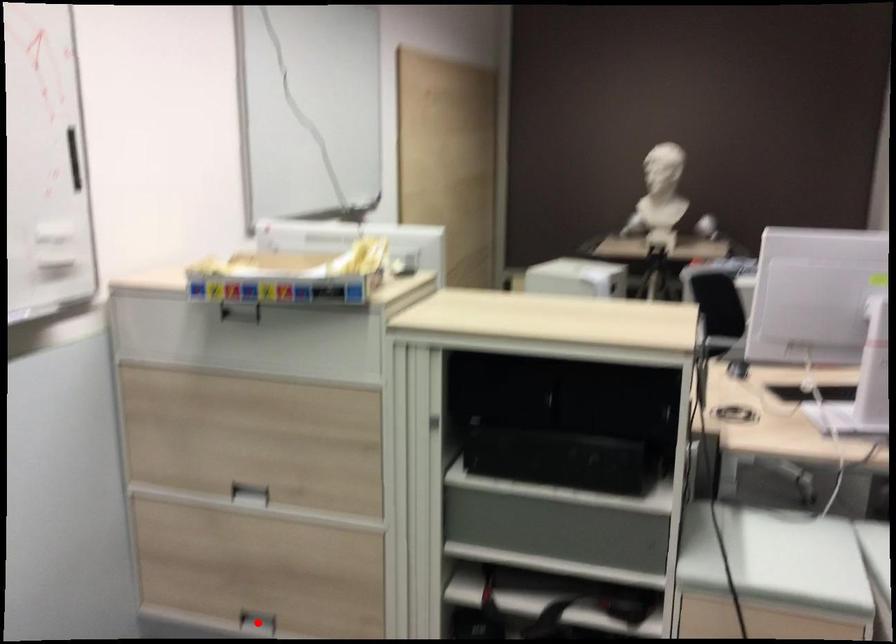
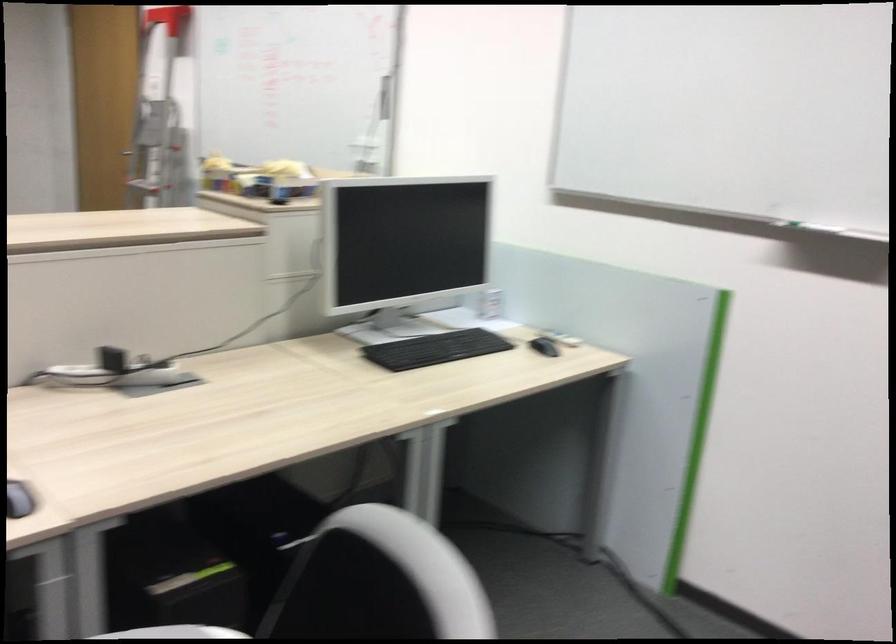
Question: I am providing you with two images of the same scene from different viewpoints. A red point is marked on the first image. At the location where the point appears in image 1, is it still visible in image 2?

Choices:
 (A) Yes
 (B) No

Answer: (B)